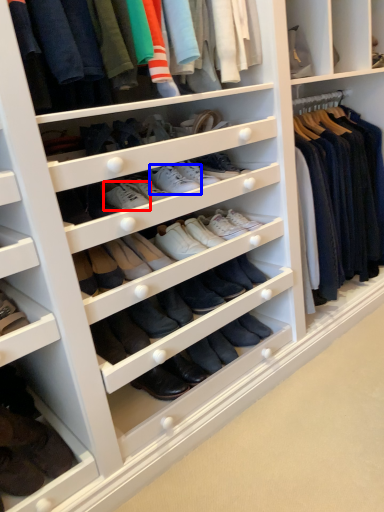
Question: Which point is closer to the camera, shoe (highlighted by a red box) or shoe (highlighted by a blue box)?

Choices:
 (A) shoe
 (B) shoe

Answer: (A)